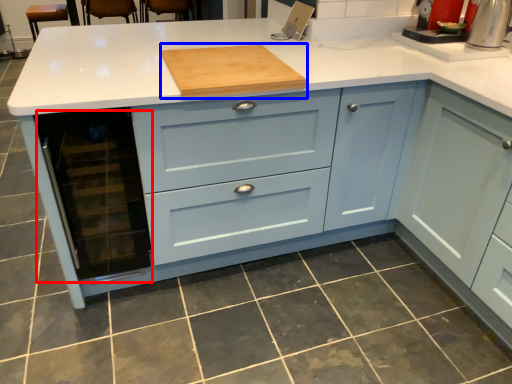
Question: Among these objects, which one is nearest to the camera, appliance (highlighted by a red box) or kitchen appliance (highlighted by a blue box)?

Choices:
 (A) appliance
 (B) kitchen appliance

Answer: (A)